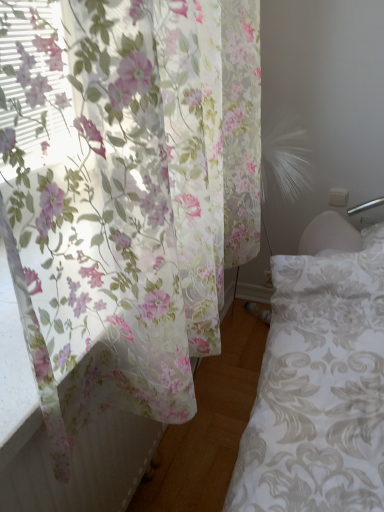
Question: Is translucent floral curtain at left positioned with its back to white damask fabric bed frame at lower right?

Choices:
 (A) no
 (B) yes

Answer: (A)

Question: From the image's perspective, is translucent floral curtain at left beneath white damask fabric bed frame at lower right?

Choices:
 (A) no
 (B) yes

Answer: (A)

Question: Does translucent floral curtain at left come in front of white damask fabric bed frame at lower right?

Choices:
 (A) no
 (B) yes

Answer: (B)

Question: Could you tell me if translucent floral curtain at left is facing white damask fabric bed frame at lower right?

Choices:
 (A) yes
 (B) no

Answer: (B)

Question: Can you confirm if translucent floral curtain at left is positioned to the right of white damask fabric bed frame at lower right?

Choices:
 (A) yes
 (B) no

Answer: (B)

Question: Are translucent floral curtain at left and white damask fabric bed frame at lower right making contact?

Choices:
 (A) yes
 (B) no

Answer: (B)

Question: Is the depth of white damask fabric bed frame at lower right less than that of translucent floral curtain at left?

Choices:
 (A) yes
 (B) no

Answer: (B)

Question: Is white damask fabric bed frame at lower right positioned with its back to translucent floral curtain at left?

Choices:
 (A) yes
 (B) no

Answer: (B)

Question: From the image's perspective, does white damask fabric bed frame at lower right appear higher than translucent floral curtain at left?

Choices:
 (A) yes
 (B) no

Answer: (B)

Question: Is white damask fabric bed frame at lower right aimed at translucent floral curtain at left?

Choices:
 (A) yes
 (B) no

Answer: (B)

Question: Is white damask fabric bed frame at lower right to the right of translucent floral curtain at left from the viewer's perspective?

Choices:
 (A) no
 (B) yes

Answer: (B)

Question: From a real-world perspective, does white damask fabric bed frame at lower right sit lower than translucent floral curtain at left?

Choices:
 (A) yes
 (B) no

Answer: (A)

Question: Is translucent floral curtain at left wider or thinner than white damask fabric bed frame at lower right?

Choices:
 (A) thin
 (B) wide

Answer: (A)